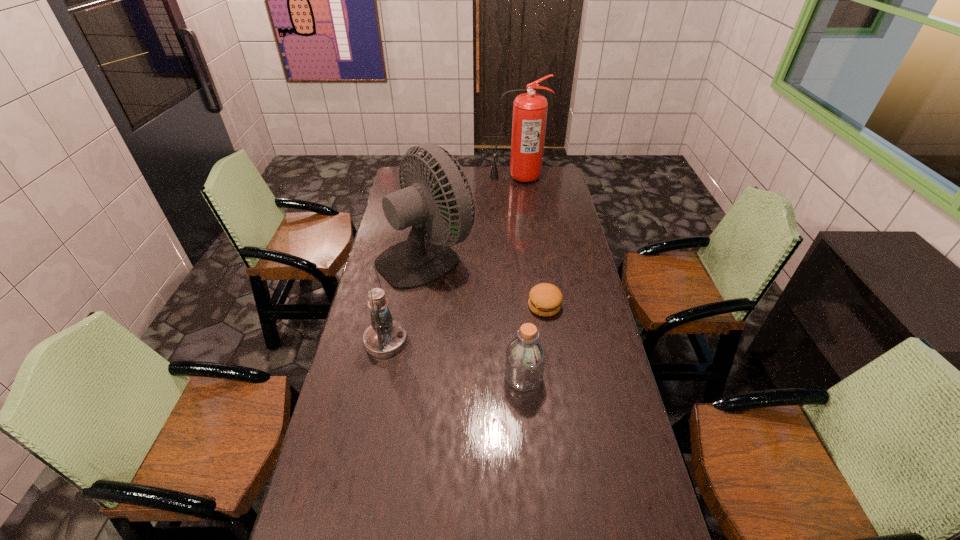
Where is `free space that satisfies the following two spatial constraints: 1. in front of the shortest object to direct airflow; 2. on the left side of the second farthest object`? free space that satisfies the following two spatial constraints: 1. in front of the shortest object to direct airflow; 2. on the left side of the second farthest object is located at coordinates (420, 306).

Identify the location of vacant region that satisfies the following two spatial constraints: 1. in front of the second farthest object to direct airflow; 2. on the back side of the nearest object. This screenshot has width=960, height=540. (409, 377).

I want to click on free point that satisfies the following two spatial constraints: 1. in front of the second farthest object to direct airflow; 2. on the right side of the shortest object, so click(420, 306).

Image resolution: width=960 pixels, height=540 pixels. I want to click on vacant space that satisfies the following two spatial constraints: 1. in front of the bottle to direct airflow; 2. on the right side of the fan, so click(409, 377).